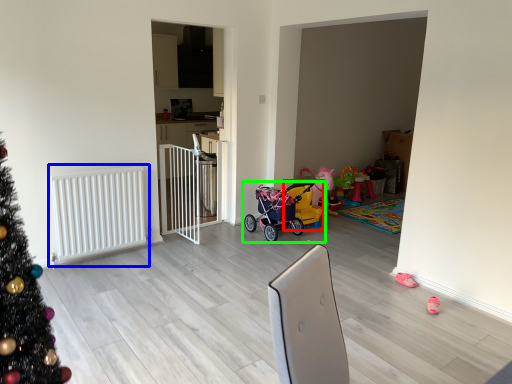
Question: Based on their relative distances, which object is nearer to baby carriage (highlighted by a red box)? Choose from radiator (highlighted by a blue box) and toy (highlighted by a green box).

Choices:
 (A) radiator
 (B) toy

Answer: (B)